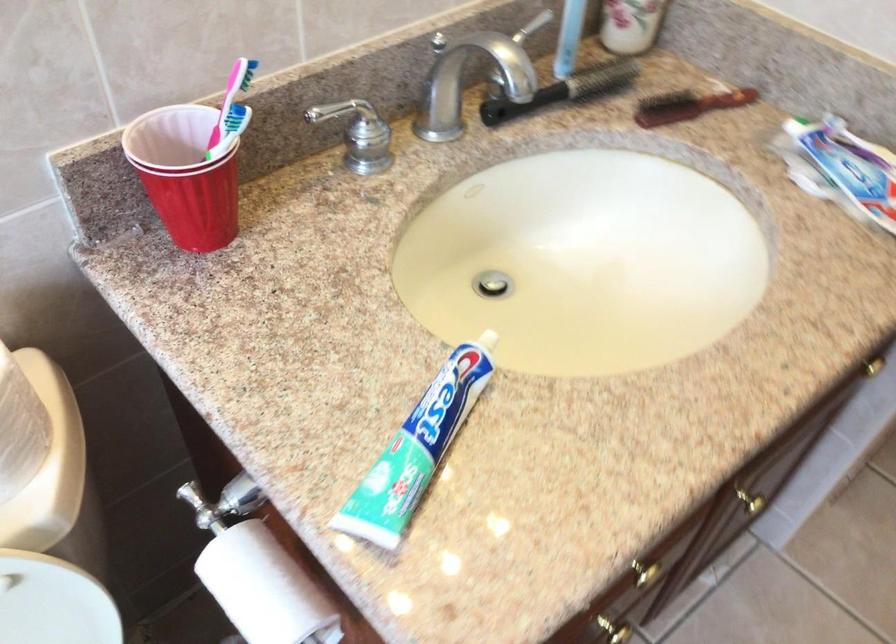
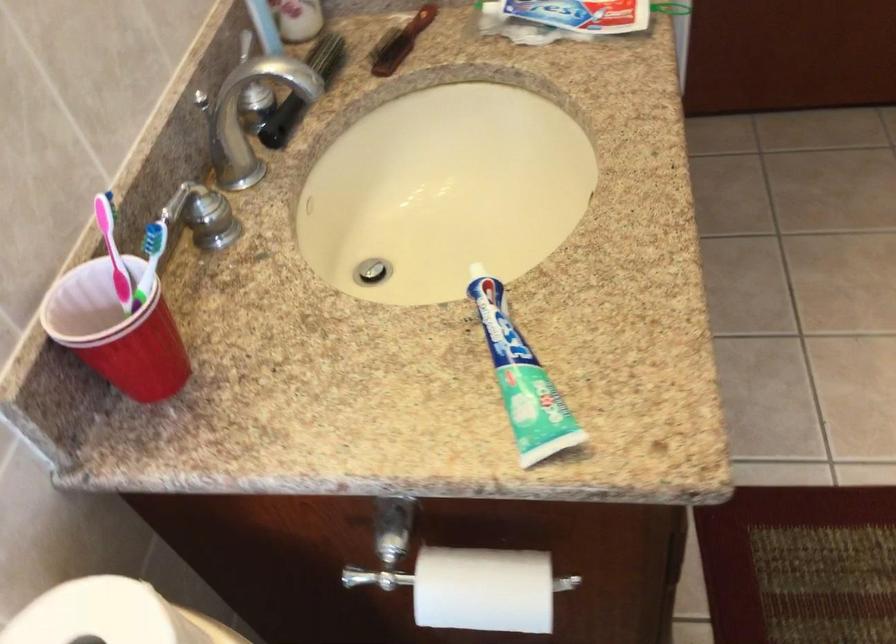
Question: The camera is either moving clockwise (left) or counter-clockwise (right) around the object. The first image is from the beginning of the video and the second image is from the end. Is the camera moving left or right when shooting the video?

Choices:
 (A) Left
 (B) Right

Answer: (A)